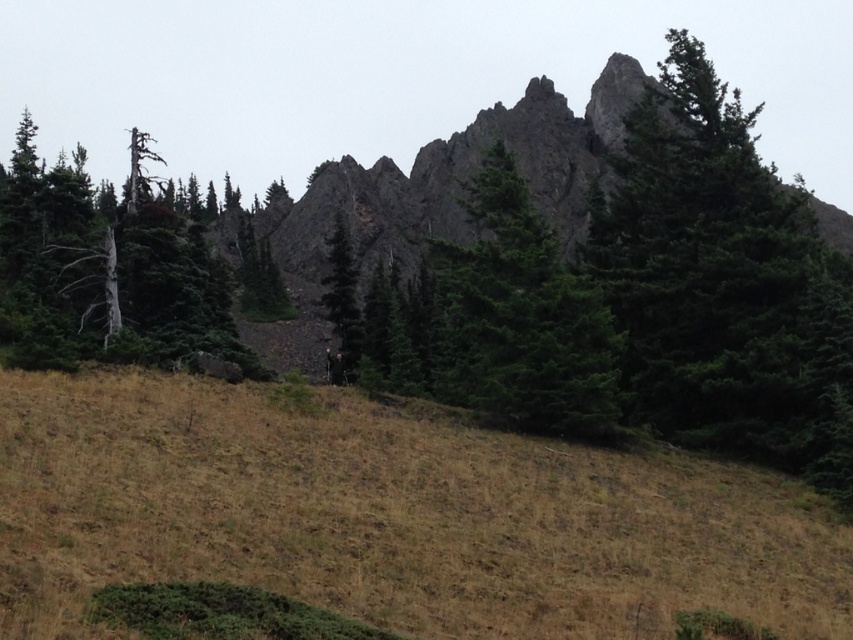
Based on the photo, you are a hiker planning to take a photo of the rocky peak in the background. You have two green matte trees in the scene to use as foreground elements. Which tree, the green matte tree at upper right or the green matte tree at center, would you choose to frame the rocky peak if you want the tree to appear larger in your photo?

You should choose the green matte tree at upper right because it is bigger than the green matte tree at center, making it a better choice to frame the rocky peak with a larger tree in the foreground.

You are planning to build a small shed and need to choose between the dead wood tree at left and the green matte tree at center for the base. Which tree has a larger diameter to provide a sturdier foundation?

The dead wood tree at left might be wider than green matte tree at center, so it could provide a sturdier foundation.